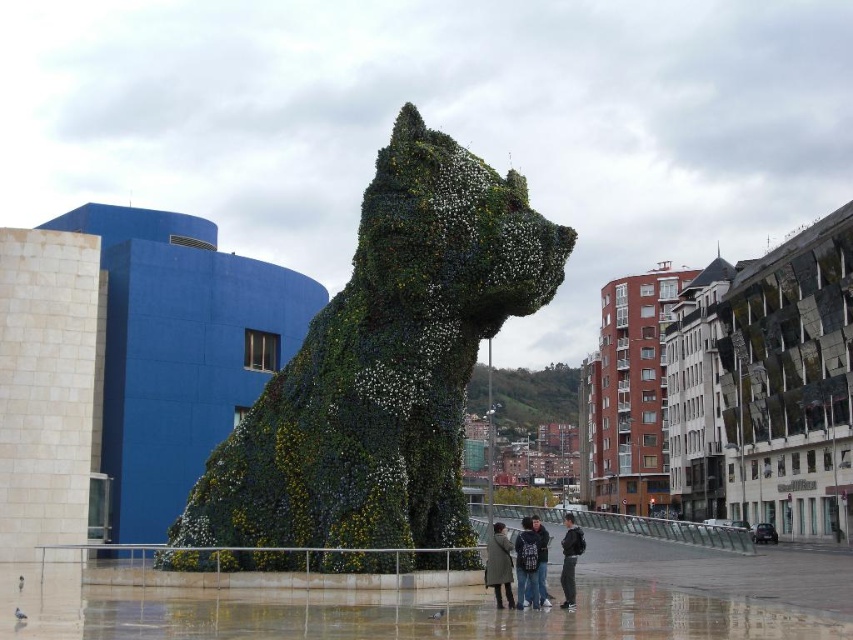
Is point (537, 589) positioned before point (573, 524)?

That is True.

Is point (529, 602) closer to viewer compared to point (581, 536)?

Yes, point (529, 602) is in front of point (581, 536).

Identify the location of dark blue jacket at center. (526, 564).

Can you confirm if green leafy sculpture at center is wider than dark gray jacket at lower center?

Yes, green leafy sculpture at center is wider than dark gray jacket at lower center.

Is green leafy sculpture at center positioned at the back of dark gray jacket at lower center?

That is True.

Where is `green leafy sculpture at center`? green leafy sculpture at center is located at coordinates (386, 364).

From the picture: Does green leafy sculpture at center have a lesser width compared to green wool coat at center?

Incorrect, green leafy sculpture at center's width is not less than green wool coat at center's.

Which is more to the right, green leafy sculpture at center or green wool coat at center?

Positioned to the right is green wool coat at center.

The image size is (853, 640). I want to click on green leafy sculpture at center, so click(386, 364).